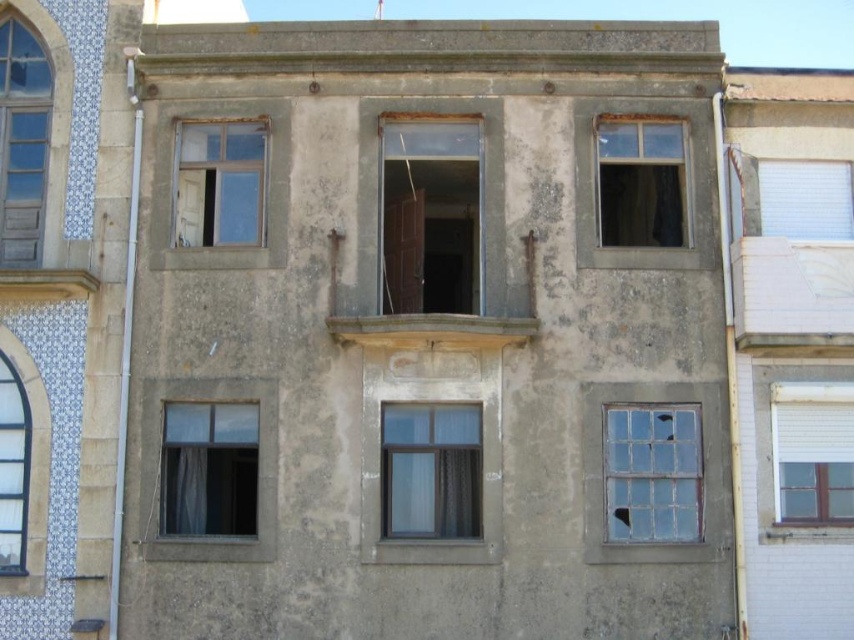
From the picture: Does wooden door at center appear over transparent glass window at lower left?

Yes.

Is wooden door at center positioned in front of transparent glass window at lower left?

That is False.

Describe the element at coordinates (431, 216) in the screenshot. I see `wooden door at center` at that location.

Find the location of a particular element. wooden door at center is located at coordinates (431, 216).

Between clear glass window at center and white textured blinds at upper right, which one is positioned lower?

clear glass window at center is below.

Can you confirm if clear glass window at center is positioned below white textured blinds at upper right?

Correct, clear glass window at center is located below white textured blinds at upper right.

Find the location of a particular element. The height and width of the screenshot is (640, 854). clear glass window at center is located at coordinates (431, 468).

Is clear glass window at lower right positioned before clear glass window at left?

That is True.

Which is below, clear glass window at lower right or clear glass window at left?

clear glass window at lower right

Is point (648, 516) less distant than point (6, 412)?

Yes, point (648, 516) is closer to viewer.

The image size is (854, 640). What are the coordinates of `clear glass window at lower right` in the screenshot? It's located at (652, 472).